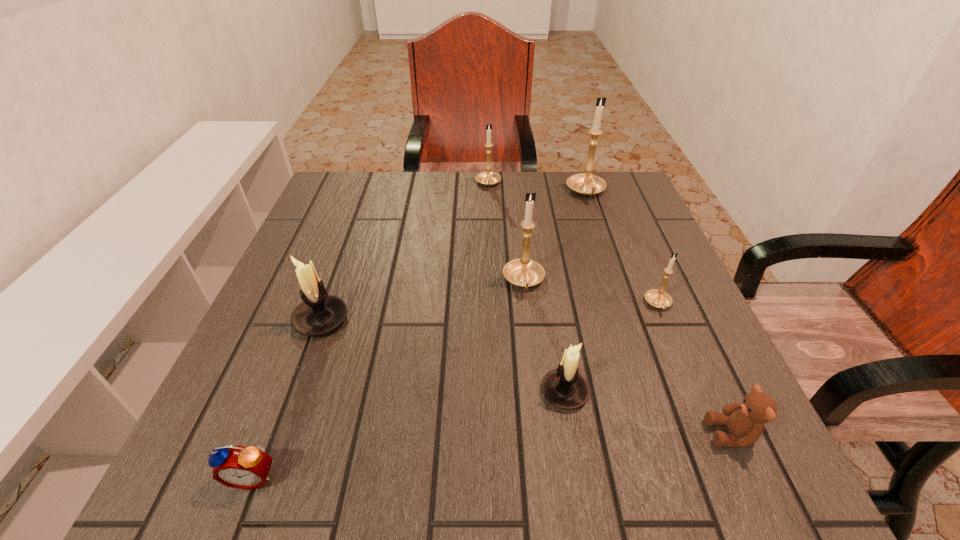
Locate an element on the screen. The width and height of the screenshot is (960, 540). vacant point located 0.260m on the face of the teddy bear is located at coordinates (540, 434).

Locate an element on the screen. free region located 0.080m on the face of the teddy bear is located at coordinates (656, 434).

You are a GUI agent. You are given a task and a screenshot of the screen. Output one action in this format:
    pyautogui.click(x=<x>, y=<y>)
    Task: Click on the vacant space located 0.310m on the face of the teddy bear
    
    Given the screenshot: What is the action you would take?
    pyautogui.click(x=507, y=434)

Where is `teddy bear that is at the near edge`? This screenshot has height=540, width=960. teddy bear that is at the near edge is located at coordinates (745, 421).

Where is `alarm clock positioned at the near edge`? The image size is (960, 540). alarm clock positioned at the near edge is located at coordinates (240, 467).

Locate an element on the screen. candle holder that is at the left edge is located at coordinates (320, 313).

Where is `alarm clock that is at the left edge`? This screenshot has height=540, width=960. alarm clock that is at the left edge is located at coordinates (240, 467).

Where is `teddy bear present at the right edge`? The image size is (960, 540). teddy bear present at the right edge is located at coordinates (745, 421).

Where is `object that is positioned at the near left corner`? object that is positioned at the near left corner is located at coordinates (240, 467).

This screenshot has width=960, height=540. Identify the location of object present at the far right corner. (587, 184).